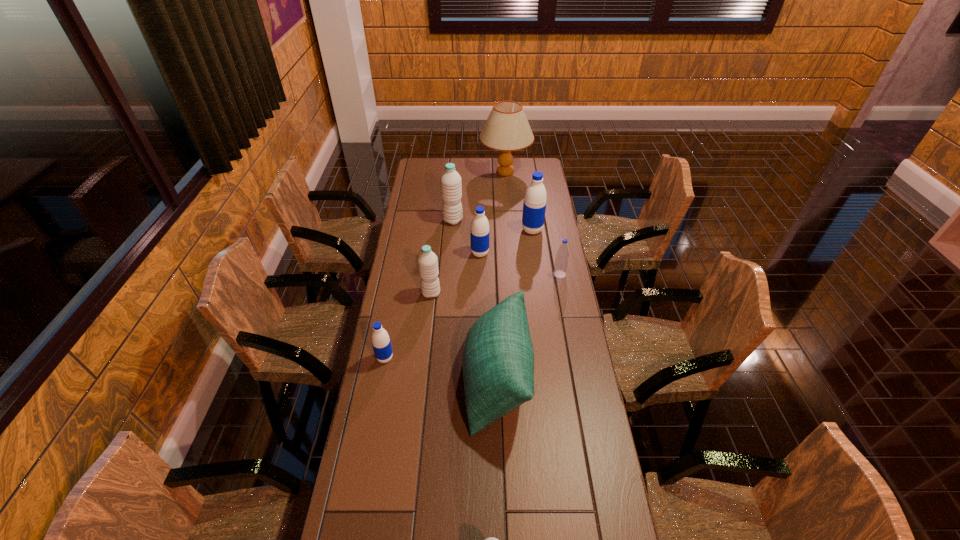
What are the coordinates of `vacant position located on the front-facing side of the cushion` in the screenshot? It's located at (443, 380).

You are a GUI agent. You are given a task and a screenshot of the screen. Output one action in this format:
    pyautogui.click(x=<x>, y=<y>)
    Task: Click on the free space located 0.300m on the front-facing side of the cushion
    
    Given the screenshot: What is the action you would take?
    tap(374, 380)

Where is `blank space located 0.140m on the back of the rightmost water bottle`? This screenshot has width=960, height=540. blank space located 0.140m on the back of the rightmost water bottle is located at coordinates (555, 248).

The image size is (960, 540). In order to click on vacant space located 0.060m on the front of the leftmost water bottle in this screenshot , I will do `click(381, 380)`.

Image resolution: width=960 pixels, height=540 pixels. I want to click on object that is positioned at the far edge, so click(x=507, y=129).

Locate an element on the screen. This screenshot has height=540, width=960. lampshade that is at the right edge is located at coordinates (507, 129).

Locate an element on the screen. The image size is (960, 540). object that is positioned at the far right corner is located at coordinates (507, 129).

Locate an element on the screen. The height and width of the screenshot is (540, 960). vacant space at the left edge of the desktop is located at coordinates (365, 403).

Identify the location of vacant space at the right edge of the desktop. The height and width of the screenshot is (540, 960). (617, 514).

Image resolution: width=960 pixels, height=540 pixels. I want to click on vacant area at the far right corner, so click(x=546, y=176).